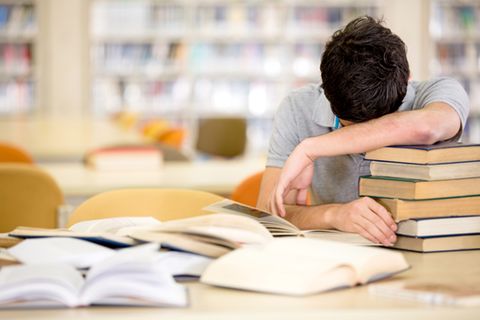
Where is `open book`? The width and height of the screenshot is (480, 320). open book is located at coordinates (323, 268), (285, 223), (232, 234), (174, 239), (175, 259), (127, 289), (58, 256), (101, 229).